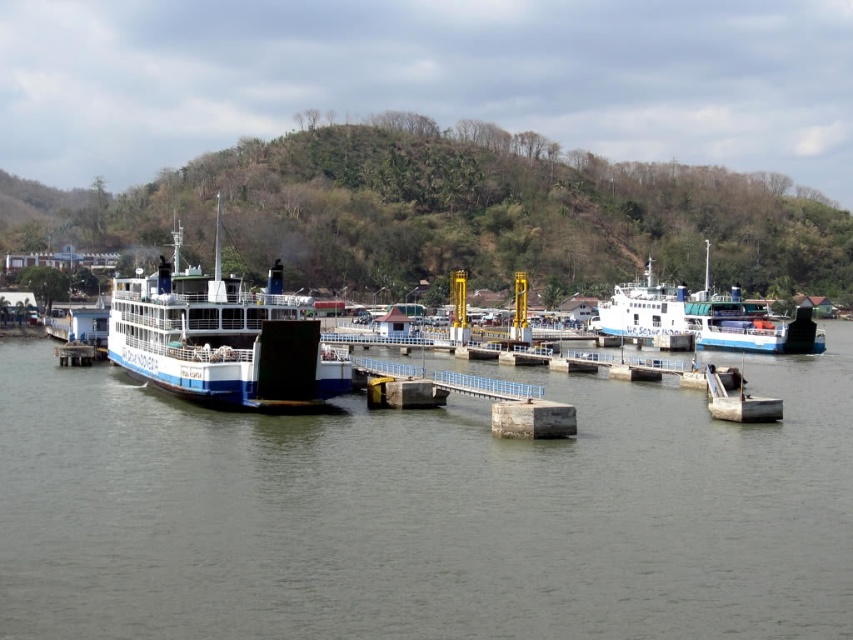
Question: Which is nearer to the blue matte ferry at center?

Choices:
 (A) white glossy ferry at center
 (B) clear water at center

Answer: (B)

Question: Considering the relative positions of clear water at center and white glossy ferry at center in the image provided, where is clear water at center located with respect to white glossy ferry at center?

Choices:
 (A) above
 (B) below

Answer: (B)

Question: Among these points, which one is nearest to the camera?

Choices:
 (A) (643, 628)
 (B) (325, 396)

Answer: (A)

Question: Which point is closer to the camera?

Choices:
 (A) (190, 332)
 (B) (167, 577)

Answer: (B)

Question: Can you confirm if clear water at center is positioned to the right of blue matte ferry at center?

Choices:
 (A) no
 (B) yes

Answer: (B)

Question: Is blue matte ferry at center to the right of white glossy ferry at center from the viewer's perspective?

Choices:
 (A) no
 (B) yes

Answer: (A)